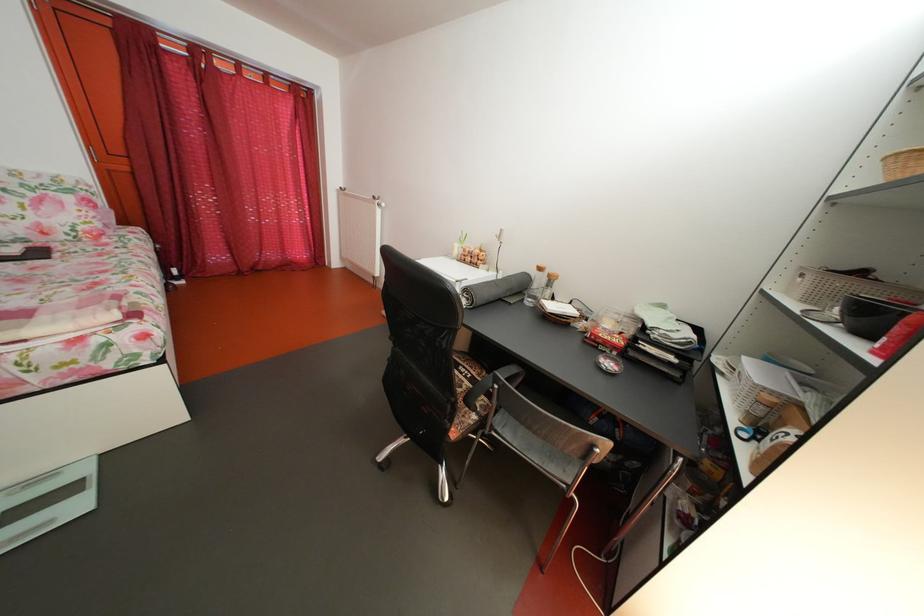
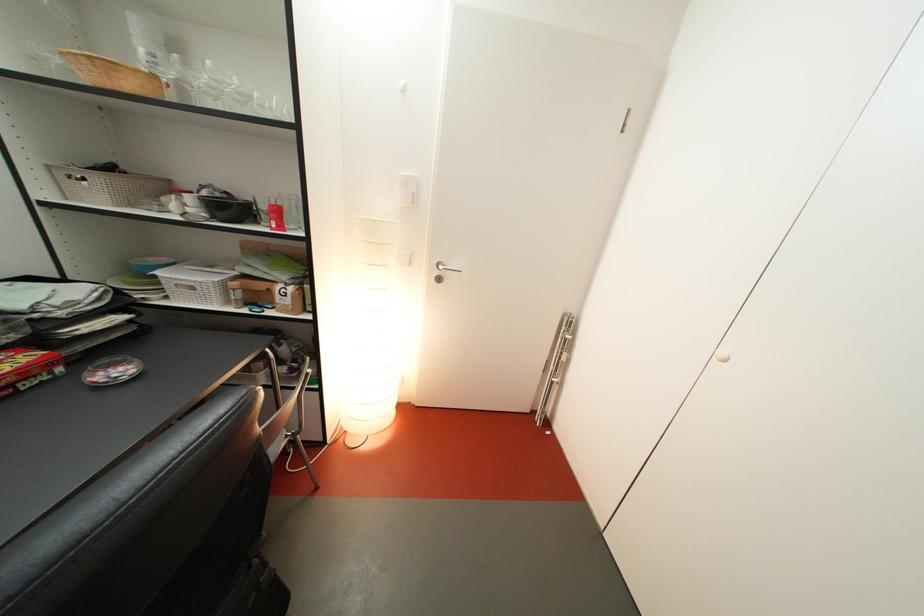
In the second image, find the point that corresponds to point 629,347 in the first image.

(38, 363)